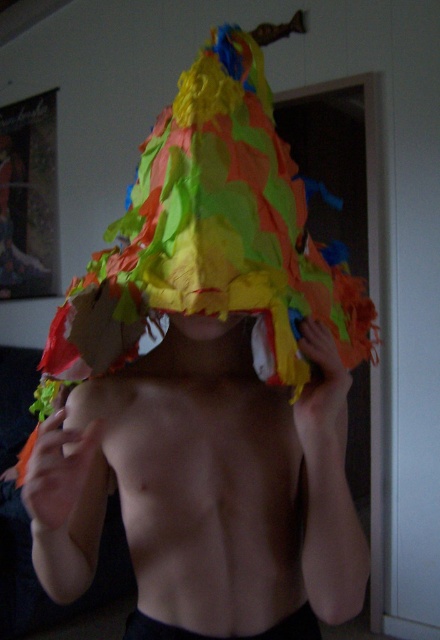
Can you confirm if black fabric at center is positioned to the right of matte paper mask at center?

Yes, black fabric at center is to the right of matte paper mask at center.

Who is taller, black fabric at center or matte paper mask at center?

With more height is black fabric at center.

You are a GUI agent. You are given a task and a screenshot of the screen. Output one action in this format:
    pyautogui.click(x=<x>, y=<y>)
    Task: Click on the black fabric at center
    This screenshot has width=440, height=640.
    Given the screenshot: What is the action you would take?
    pyautogui.click(x=223, y=636)

You are a GUI agent. You are given a task and a screenshot of the screen. Output one action in this format:
    pyautogui.click(x=<x>, y=<y>)
    Task: Click on the black fabric at center
    
    Given the screenshot: What is the action you would take?
    pyautogui.click(x=223, y=636)